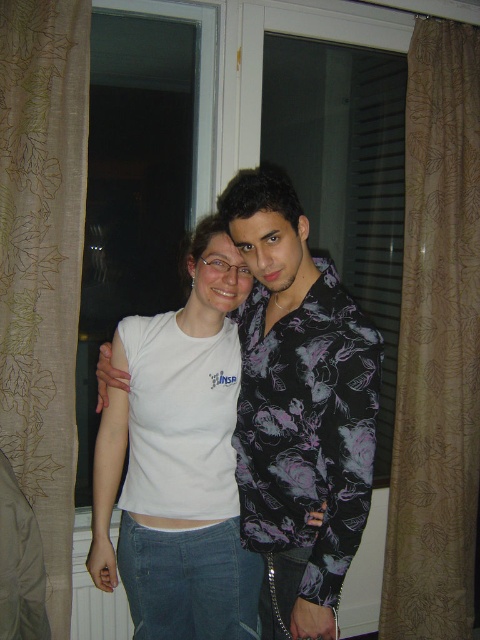
Does white matte t-shirt at center have a greater width compared to brown textured curtain at right?

No.

Does point (371, 333) come farther from viewer compared to point (468, 524)?

No, it is in front of (468, 524).

This screenshot has width=480, height=640. In order to click on white matte t-shirt at center in this screenshot , I will do `click(300, 406)`.

Is point (462, 444) positioned in front of point (88, 20)?

No, it is behind (88, 20).

Does brown textured curtain at right have a larger size compared to brown textured curtain at left?

Indeed, brown textured curtain at right has a larger size compared to brown textured curtain at left.

Is point (386, 561) closer to viewer compared to point (10, 440)?

No, (386, 561) is further to viewer.

Find the location of a particular element. The height and width of the screenshot is (640, 480). brown textured curtain at right is located at coordinates (436, 346).

Is white matte t-shirt at center positioned at the back of brown textured curtain at left?

No, it is in front of brown textured curtain at left.

Which is behind, point (248, 237) or point (12, 362)?

The point (12, 362) is more distant.

At what (x,y) coordinates should I click in order to perform the action: click on white matte t-shirt at center. Please return your answer as a coordinate pair (x, y). Looking at the image, I should click on (300, 406).